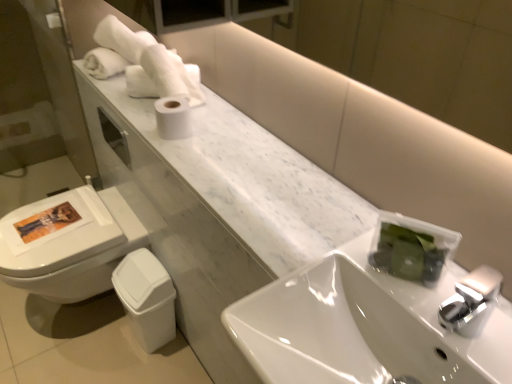
The image size is (512, 384). Find the location of `vacant area that lies to the right of white matte toilet paper at center`. vacant area that lies to the right of white matte toilet paper at center is located at coordinates (217, 132).